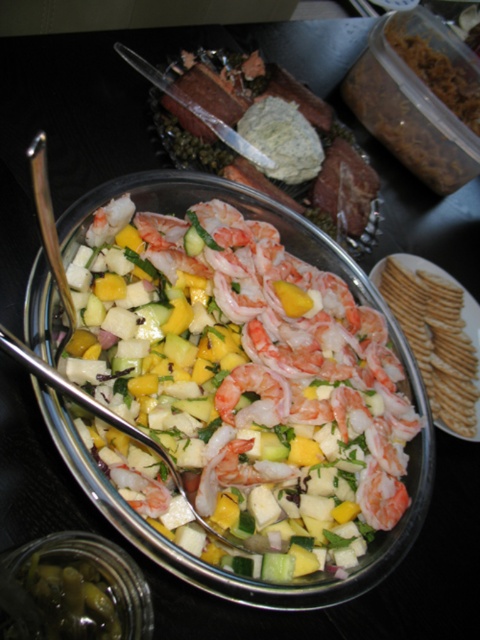
Question: Can you confirm if shiny pink shrimp at center is positioned to the right of pinkish matte shrimp at center?

Choices:
 (A) no
 (B) yes

Answer: (A)

Question: Which of the following is the closest to the observer?

Choices:
 (A) (284, 417)
 (B) (134, 413)

Answer: (B)

Question: Is shiny pink shrimp at center further to camera compared to pinkish matte shrimp at center?

Choices:
 (A) yes
 (B) no

Answer: (B)

Question: Which point is farther to the camera?

Choices:
 (A) (264, 412)
 (B) (393, 496)

Answer: (B)

Question: Does shiny pink shrimp at center come in front of pink glossy shrimp at center?

Choices:
 (A) yes
 (B) no

Answer: (A)

Question: Which of the following is the closest to the observer?

Choices:
 (A) (374, 497)
 (B) (267, 387)
 (C) (202, 417)

Answer: (C)